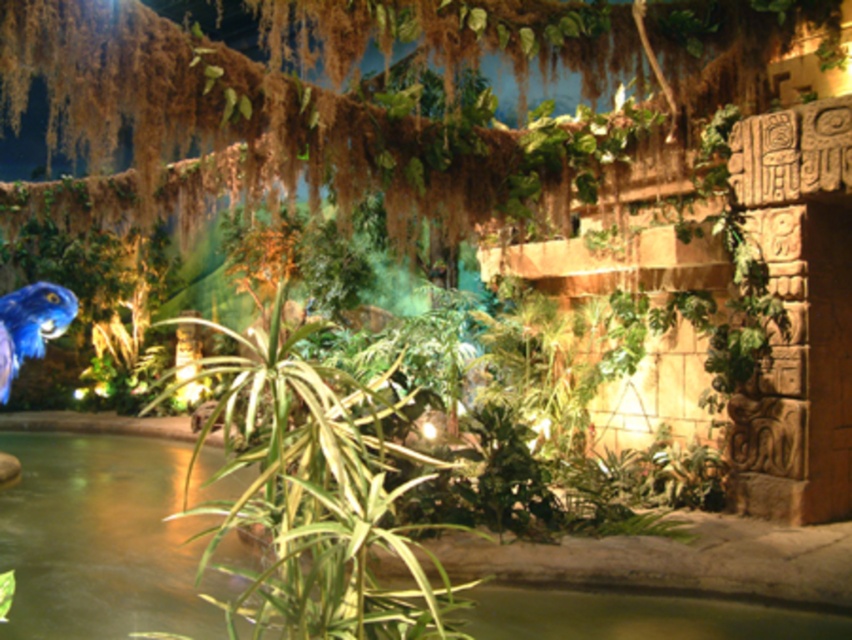
You are standing in the tropical indoor setting and want to locate the point at coordinates (102, 540). According to the scene description, where exactly is this point located?

The point at coordinates (102, 540) is on the green leafy pond at center.

You are a visitor in this tropical indoor setting and want to take a photo of both the green leafy pond at center and the green leafy plant at center. Which one should you focus on first if you want to capture both in a single frame without moving your camera?

You should focus on the green leafy pond at center first because it is wider than the green leafy plant at center, allowing more space for both in the frame.

You are standing in the tropical indoor setting and want to take a photo of both the green leafy pond at center and the green leafy plant at center. Which one should you focus on first to ensure both are in the frame?

You should focus on the green leafy plant at center first because it is closer to you than the green leafy pond at center, which is further away. This way, adjusting the camera to include both in the frame will be easier.